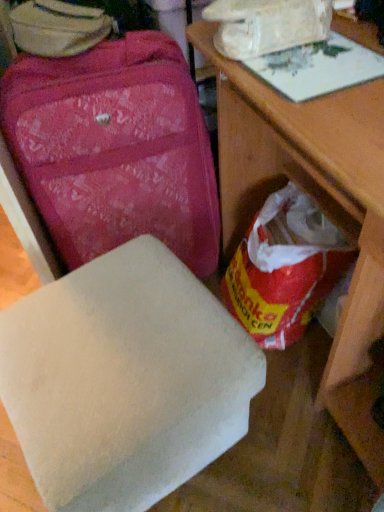
Question: Would you consider red plastic grocery bag at lower right to be distant from matte pink suitcase at upper left?

Choices:
 (A) no
 (B) yes

Answer: (A)

Question: Is red plastic grocery bag at lower right facing towards matte pink suitcase at upper left?

Choices:
 (A) no
 (B) yes

Answer: (A)

Question: Can you confirm if red plastic grocery bag at lower right is positioned to the left of matte pink suitcase at upper left?

Choices:
 (A) yes
 (B) no

Answer: (B)

Question: Considering the relative sizes of red plastic grocery bag at lower right and matte pink suitcase at upper left in the image provided, is red plastic grocery bag at lower right smaller than matte pink suitcase at upper left?

Choices:
 (A) yes
 (B) no

Answer: (A)

Question: Can you confirm if red plastic grocery bag at lower right is thinner than matte pink suitcase at upper left?

Choices:
 (A) no
 (B) yes

Answer: (B)

Question: In terms of size, does white matte foam at lower center appear bigger or smaller than matte pink suitcase at upper left?

Choices:
 (A) small
 (B) big

Answer: (A)

Question: Does point [160, 396] appear closer or farther from the camera than point [182, 212]?

Choices:
 (A) farther
 (B) closer

Answer: (B)

Question: Is white matte foam at lower center wider or thinner than matte pink suitcase at upper left?

Choices:
 (A) thin
 (B) wide

Answer: (B)

Question: From a real-world perspective, is white matte foam at lower center physically located above or below matte pink suitcase at upper left?

Choices:
 (A) above
 (B) below

Answer: (B)

Question: Is white matte foam at lower center to the left or to the right of wooden table at center in the image?

Choices:
 (A) right
 (B) left

Answer: (B)

Question: From the image's perspective, is white matte foam at lower center located above or below wooden table at center?

Choices:
 (A) below
 (B) above

Answer: (A)

Question: Is white matte foam at lower center inside or outside of wooden table at center?

Choices:
 (A) outside
 (B) inside

Answer: (A)

Question: Considering the positions of white matte foam at lower center and wooden table at center in the image, is white matte foam at lower center wider or thinner than wooden table at center?

Choices:
 (A) wide
 (B) thin

Answer: (B)

Question: Is matte pink suitcase at upper left taller or shorter than red plastic grocery bag at lower right?

Choices:
 (A) short
 (B) tall

Answer: (B)

Question: Relative to red plastic grocery bag at lower right, is matte pink suitcase at upper left in front or behind?

Choices:
 (A) behind
 (B) front

Answer: (B)